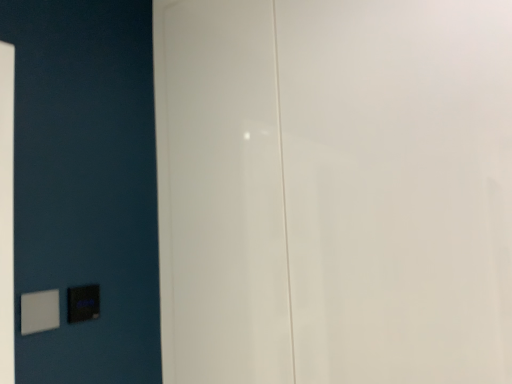
Question: Is white plastic light switch at lower left, the first light switch positioned from the left, thinner than matte black switch at lower left, the second light switch in the left-to-right sequence?

Choices:
 (A) yes
 (B) no

Answer: (B)

Question: Is white plastic light switch at lower left, which ranks as the first light switch in front-to-back order, in front of matte black switch at lower left, the first light switch in the back-to-front sequence?

Choices:
 (A) yes
 (B) no

Answer: (A)

Question: Can you confirm if white plastic light switch at lower left, the first light switch positioned from the left, is wider than matte black switch at lower left, which is counted as the 2th light switch, starting from the front?

Choices:
 (A) yes
 (B) no

Answer: (A)

Question: Is matte black switch at lower left, which is counted as the 2th light switch, starting from the front, located within white plastic light switch at lower left, which is the 2th light switch in right-to-left order?

Choices:
 (A) yes
 (B) no

Answer: (B)

Question: From a real-world perspective, is white plastic light switch at lower left, the first light switch positioned from the left, positioned under matte black switch at lower left, which is counted as the 2th light switch, starting from the front, based on gravity?

Choices:
 (A) yes
 (B) no

Answer: (A)

Question: Can you confirm if white plastic light switch at lower left, the first light switch positioned from the left, is positioned to the left of matte black switch at lower left, which is counted as the 2th light switch, starting from the front?

Choices:
 (A) no
 (B) yes

Answer: (B)

Question: Is white glossy door at center outside of white plastic light switch at lower left, the first light switch positioned from the left?

Choices:
 (A) no
 (B) yes

Answer: (B)

Question: Could you tell me if white glossy door at center is facing white plastic light switch at lower left, the first light switch positioned from the left?

Choices:
 (A) no
 (B) yes

Answer: (B)

Question: Is white glossy door at center positioned behind white plastic light switch at lower left, the first light switch positioned from the left?

Choices:
 (A) yes
 (B) no

Answer: (B)

Question: From the image's perspective, is white glossy door at center on white plastic light switch at lower left, which ranks as the first light switch in front-to-back order?

Choices:
 (A) no
 (B) yes

Answer: (B)

Question: Is the position of white glossy door at center less distant than that of white plastic light switch at lower left, the first light switch positioned from the left?

Choices:
 (A) yes
 (B) no

Answer: (A)

Question: Is white plastic light switch at lower left, the first light switch positioned from the left, completely or partially inside white glossy door at center?

Choices:
 (A) yes
 (B) no

Answer: (B)

Question: Can you confirm if white glossy door at center is taller than matte black switch at lower left, the first light switch in the back-to-front sequence?

Choices:
 (A) yes
 (B) no

Answer: (A)